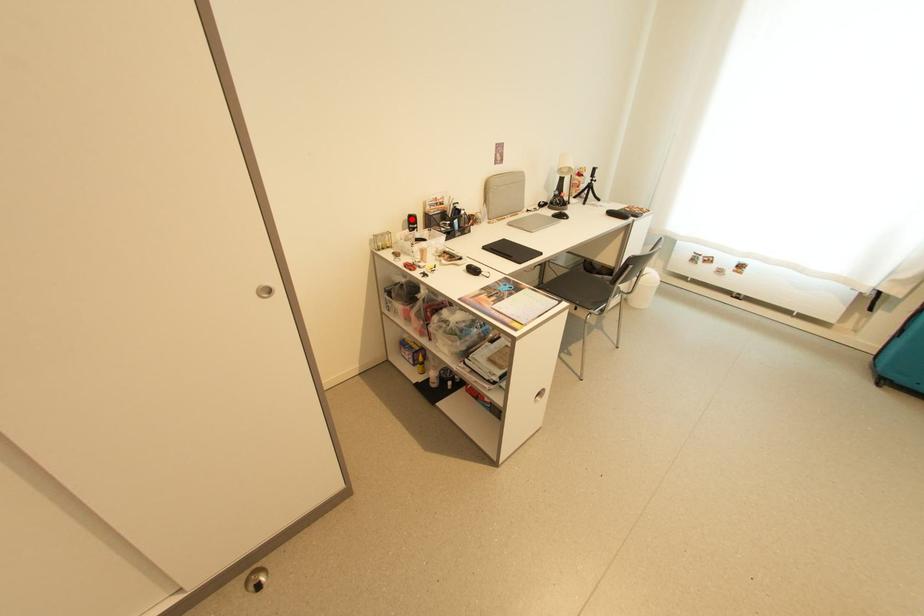
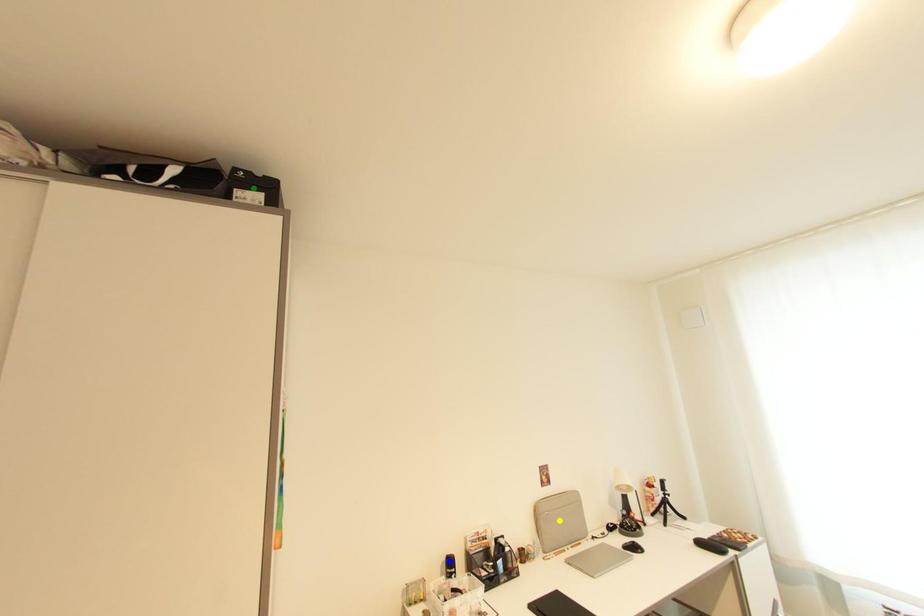
Question: I am providing you with two images of the same scene from different viewpoints. A red point is marked on the first image. You are given multiple points on the second image. Can you choose the point in image 2 that corresponds to the point in image 1?

Choices:
 (A) yellow point
 (B) green point
 (C) blue point

Answer: (C)